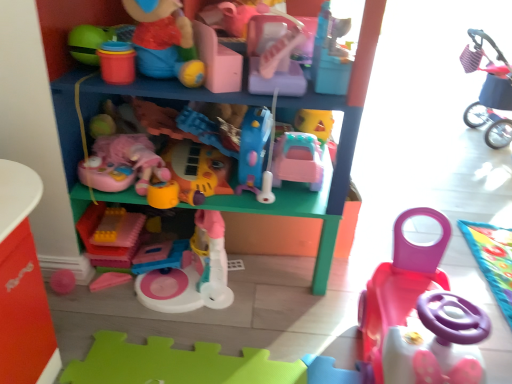
Identify the location of vacant area that lies between matte plastic toy car at lower right and pink plastic toy at center, the 7th toy in the right-to-left sequence. (264, 302).